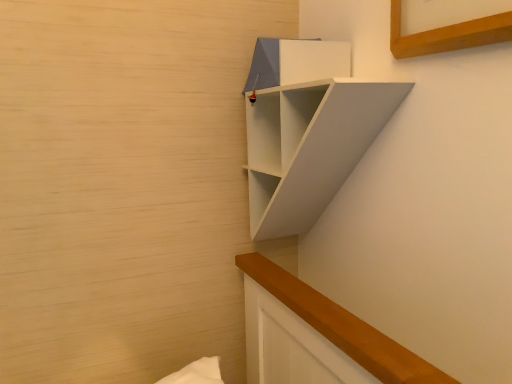
Question: From the image's perspective, is white matte shelf at upper right positioned above or below matte white cabinet at upper center?

Choices:
 (A) above
 (B) below

Answer: (B)

Question: Is point (295, 109) closer or farther from the camera than point (283, 51)?

Choices:
 (A) closer
 (B) farther

Answer: (B)

Question: From a real-world perspective, relative to matte white cabinet at upper center, is white matte shelf at upper right vertically above or below?

Choices:
 (A) below
 (B) above

Answer: (A)

Question: Is matte white cabinet at upper center wider or thinner than white matte shelf at upper right?

Choices:
 (A) wide
 (B) thin

Answer: (B)

Question: Based on their sizes in the image, would you say matte white cabinet at upper center is bigger or smaller than white matte shelf at upper right?

Choices:
 (A) small
 (B) big

Answer: (A)

Question: From the image's perspective, is matte white cabinet at upper center located above or below white matte shelf at upper right?

Choices:
 (A) above
 (B) below

Answer: (A)

Question: Is matte white cabinet at upper center inside or outside of white matte shelf at upper right?

Choices:
 (A) outside
 (B) inside

Answer: (B)